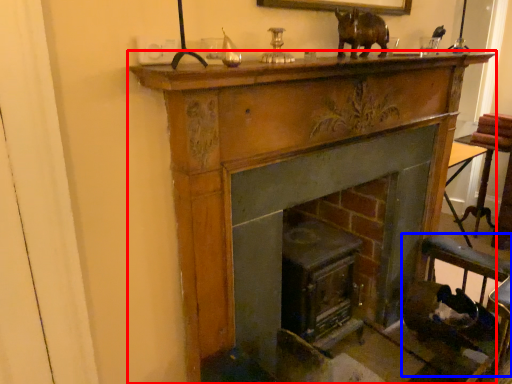
Question: Which object is closer to the camera taking this photo, fireplace (highlighted by a red box) or rocking chair (highlighted by a blue box)?

Choices:
 (A) fireplace
 (B) rocking chair

Answer: (A)